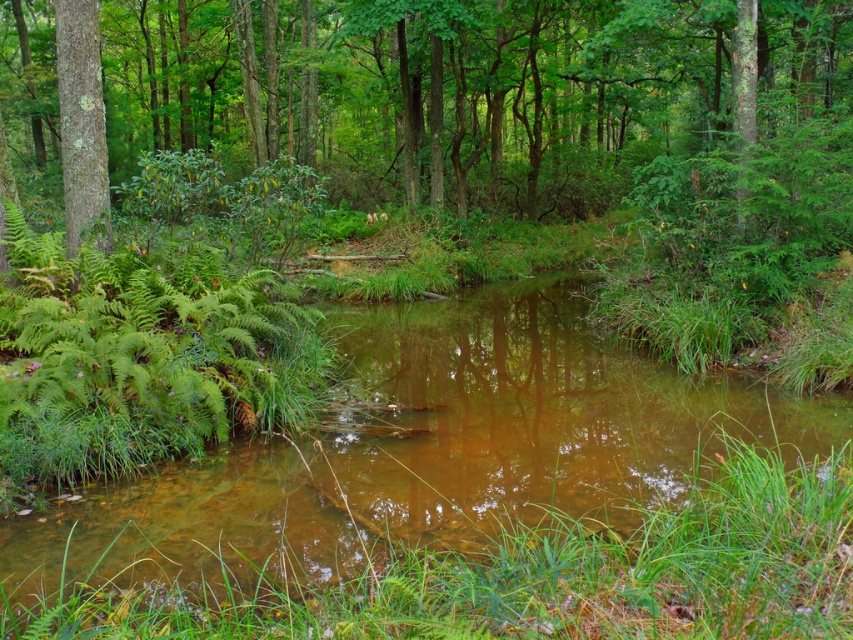
Does point (109, 636) lie in front of point (62, 147)?

Yes, it is in front of point (62, 147).

Which is more to the left, clear water stream at center or smooth bark tree at left?

smooth bark tree at left

Does point (535, 300) come behind point (84, 186)?

Yes, it is behind point (84, 186).

Where is `clear water stream at center`? clear water stream at center is located at coordinates (473, 500).

Is point (312, 600) closer to camera compared to point (178, 84)?

Yes.

Between point (787, 483) and point (117, 104), which one is positioned behind?

Point (117, 104)

Between point (807, 561) and point (183, 129), which one is positioned in front?

Point (807, 561) is more forward.

You are a GUI agent. You are given a task and a screenshot of the screen. Output one action in this format:
    pyautogui.click(x=<x>, y=<y>)
    Task: Click on the clear water stream at center
    
    Given the screenshot: What is the action you would take?
    pyautogui.click(x=473, y=500)

Does point (708, 125) come in front of point (61, 93)?

No, it is not.

At what (x,y) coordinates should I click in order to perform the action: click on green leafy tree at center. Please return your answer as a coordinate pair (x, y). Looking at the image, I should click on (466, 90).

You are a GUI agent. You are given a task and a screenshot of the screen. Output one action in this format:
    pyautogui.click(x=<x>, y=<y>)
    Task: Click on the green leafy tree at center
    The height and width of the screenshot is (640, 853).
    Given the screenshot: What is the action you would take?
    pyautogui.click(x=466, y=90)